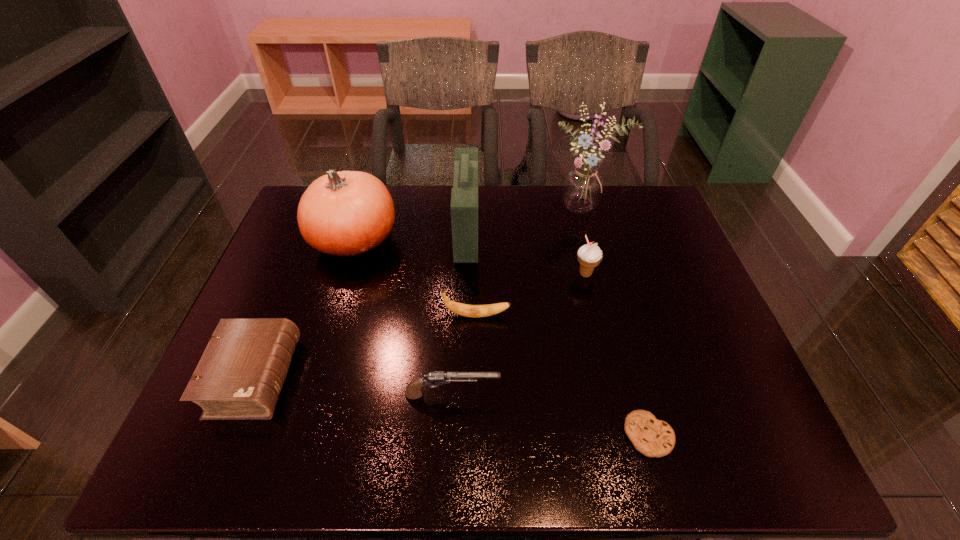
Identify the location of vacant area situated on the front-facing side of the first-aid kit. This screenshot has height=540, width=960. (516, 231).

At what (x,y) coordinates should I click in order to perform the action: click on vacant region located 0.330m on the front of the fifth shortest object. Please return your answer as a coordinate pair (x, y). Looking at the image, I should click on (612, 390).

This screenshot has width=960, height=540. What are the coordinates of `free space located 0.120m on the peel of the banana from the top` in the screenshot? It's located at (557, 315).

Where is `blank space located 0.210m on the spine side of the Bible`? blank space located 0.210m on the spine side of the Bible is located at coordinates (383, 377).

The height and width of the screenshot is (540, 960). I want to click on free point located 0.280m aiming along the barrel of the gun, so click(625, 395).

In order to click on vacant space located on the back of the shortest object in this screenshot , I will do `click(629, 361)`.

Locate an element on the screen. The image size is (960, 540). bouquet present at the far edge is located at coordinates (582, 188).

Image resolution: width=960 pixels, height=540 pixels. I want to click on pumpkin present at the far edge, so click(x=348, y=213).

You are a GUI agent. You are given a task and a screenshot of the screen. Output one action in this format:
    pyautogui.click(x=<x>, y=<y>)
    Task: Click on the first-aid kit that is positioned at the far edge
    This screenshot has width=960, height=540.
    Given the screenshot: What is the action you would take?
    pyautogui.click(x=464, y=197)

This screenshot has height=540, width=960. I want to click on object positioned at the near edge, so click(x=653, y=438).